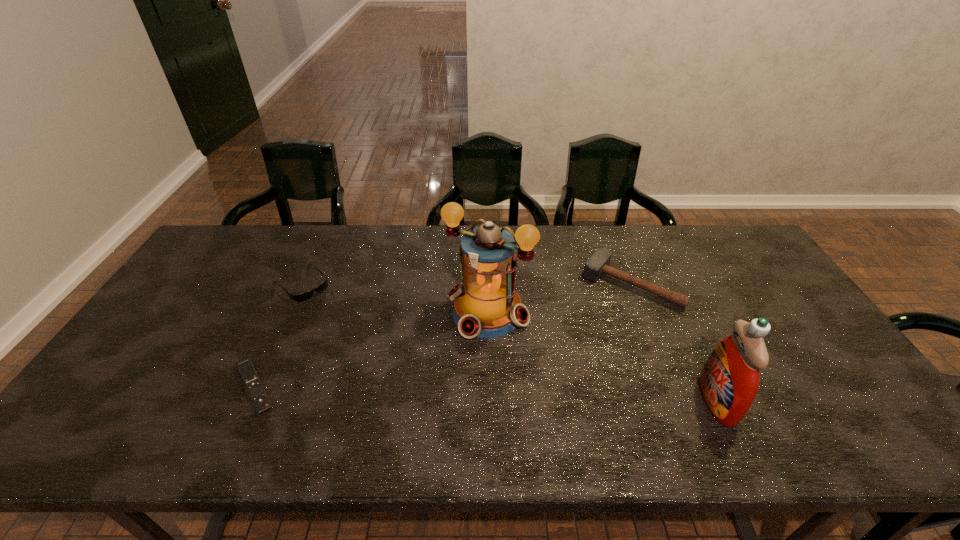
Locate an element on the screen. Image resolution: width=960 pixels, height=540 pixels. free space between the lantern and the sunglasses is located at coordinates (395, 298).

The image size is (960, 540). Identify the location of free area in between the third tallest object and the third object from left to right. (559, 298).

In order to click on empty space that is in between the shortest object and the fourth shortest object in this screenshot , I will do `click(486, 394)`.

Locate an element on the screen. The height and width of the screenshot is (540, 960). free spot between the fourth shortest object and the hammer is located at coordinates (673, 343).

I want to click on empty location between the shortest object and the third shortest object, so click(x=443, y=336).

I want to click on empty location between the sunglasses and the detergent, so click(x=510, y=342).

This screenshot has height=540, width=960. Identify the location of the second closest object to the shortest object. point(486,305).

Locate an element on the screen. object that can be found as the third closest to the shortest object is located at coordinates (598, 264).

Identify the location of free space that satisfies the following two spatial constraints: 1. on the front side of the second tallest object; 2. on the front surface of the sunglasses. The width and height of the screenshot is (960, 540). (249, 401).

Locate an element on the screen. Image resolution: width=960 pixels, height=540 pixels. free space that satisfies the following two spatial constraints: 1. on the back side of the shortest object; 2. on the right side of the tallest object is located at coordinates (289, 312).